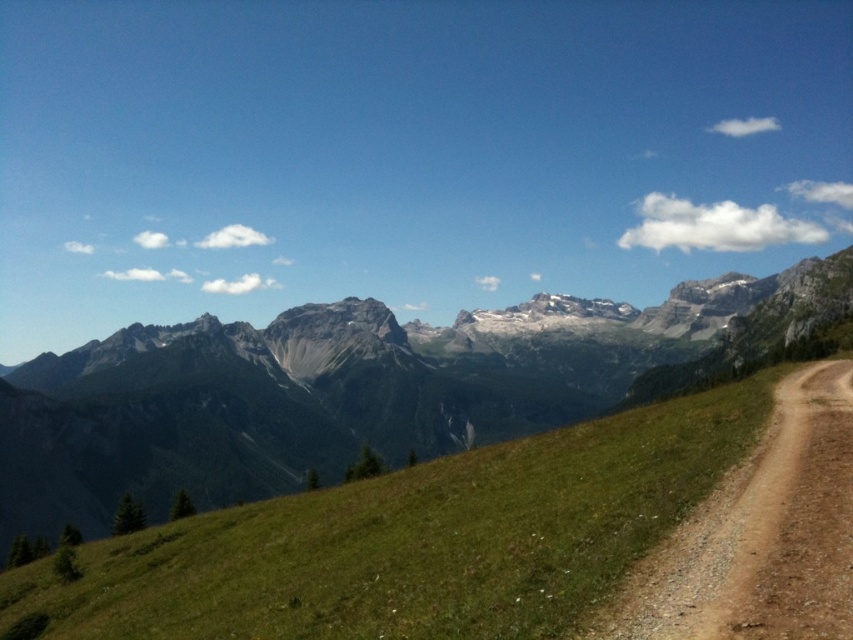
What are the coordinates of the gray rocky mountain range at center?

The gray rocky mountain range at center is located at coordinates point [358,388].